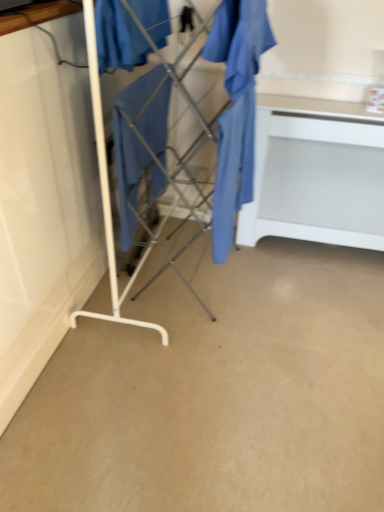
At what (x,y) coordinates should I click in order to perform the action: click on free space underneath matte blue fabric at center, the first clothing from the right (from a real-world perspective). Please return your answer as a coordinate pair (x, y). This screenshot has height=512, width=384. Looking at the image, I should click on click(231, 281).